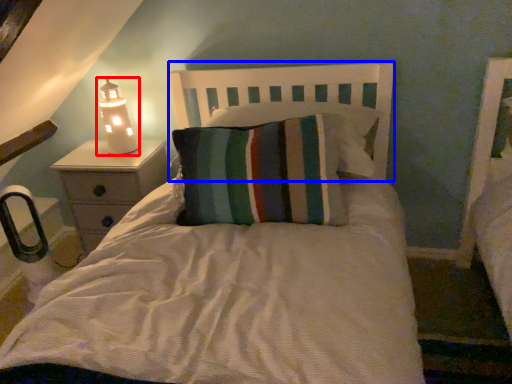
Question: Which point is closer to the camera, lamp (highlighted by a red box) or headboard (highlighted by a blue box)?

Choices:
 (A) lamp
 (B) headboard

Answer: (B)